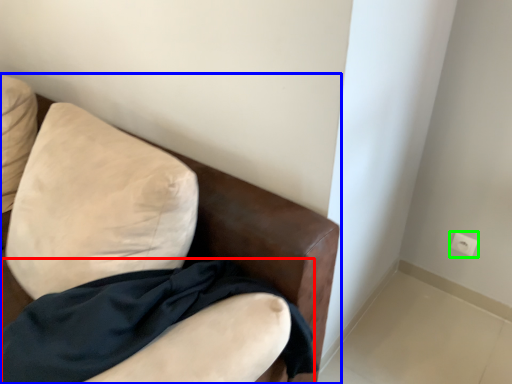
Question: Based on their relative distances, which object is farther from fabric (highlighted by a red box)? Choose from furniture (highlighted by a blue box) and electric outlet (highlighted by a green box).

Choices:
 (A) furniture
 (B) electric outlet

Answer: (B)